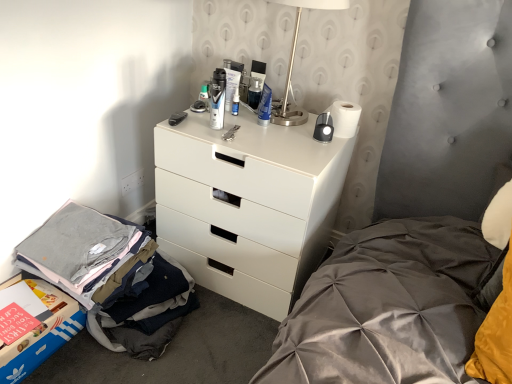
Locate an element on the screen. The width and height of the screenshot is (512, 384). vacant space in front of matte plastic tube at upper center, which ranks as the third toiletry in left-to-right order is located at coordinates (223, 126).